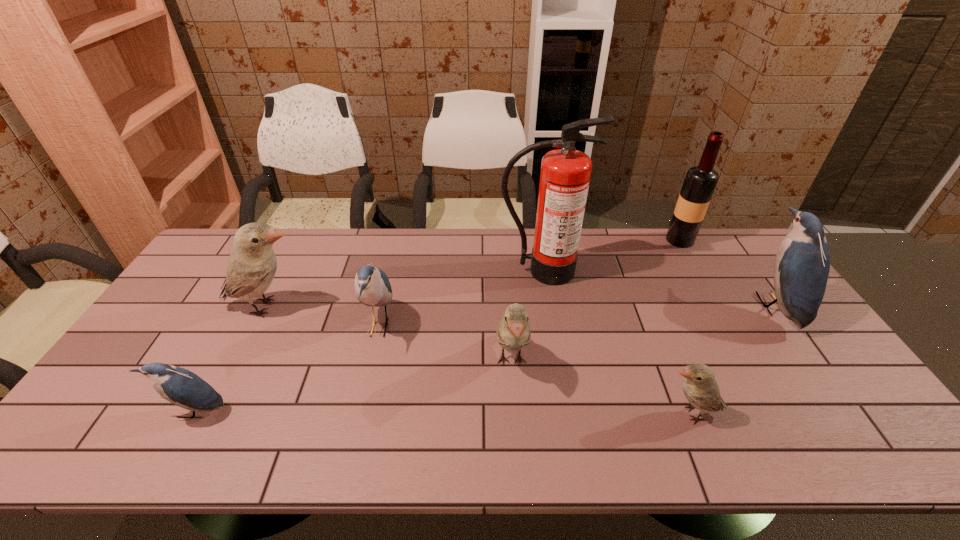
The width and height of the screenshot is (960, 540). In order to click on free spot between the farthest object and the nearest blue bird in this screenshot , I will do `click(437, 326)`.

Where is `vacant area between the tallest object and the nearest white bird`? This screenshot has width=960, height=540. vacant area between the tallest object and the nearest white bird is located at coordinates (616, 342).

Image resolution: width=960 pixels, height=540 pixels. I want to click on free spot between the red fire extinguisher and the smallest blue bird, so click(x=368, y=341).

Locate an element on the screen. free space between the fire extinguisher and the farthest object is located at coordinates (611, 255).

At what (x,y) coordinates should I click in order to perform the action: click on unoccupied position between the rightmost white bird and the rightmost blue bird. Please return your answer as a coordinate pair (x, y). The width and height of the screenshot is (960, 540). Looking at the image, I should click on (732, 360).

Select which object is the closest to the second white bird from right to left. Please provide its 2D coordinates. Your answer should be formatted as a tuple, i.e. [(x, y)], where the tuple contains the x and y coordinates of a point satisfying the conditions above.

[(565, 174)]

The height and width of the screenshot is (540, 960). I want to click on object that stands as the fifth closest to the biggest white bird, so click(701, 389).

Identify the location of bird object that ranks as the fifth closest to the second white bird from left to right. (802, 264).

Where is `the third closest bird to the fire extinguisher`? the third closest bird to the fire extinguisher is located at coordinates (701, 389).

At what (x,y) coordinates should I click in order to perform the action: click on blue bird that is the closest one to the farthest white bird. Please return your answer as a coordinate pair (x, y). Image resolution: width=960 pixels, height=540 pixels. Looking at the image, I should click on (372, 286).